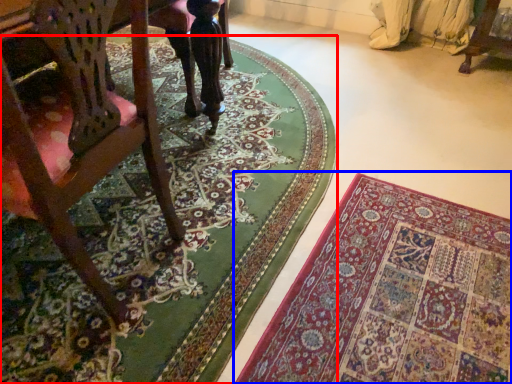
Question: Which object is further to the camera taking this photo, mat (highlighted by a red box) or mat (highlighted by a blue box)?

Choices:
 (A) mat
 (B) mat

Answer: (A)